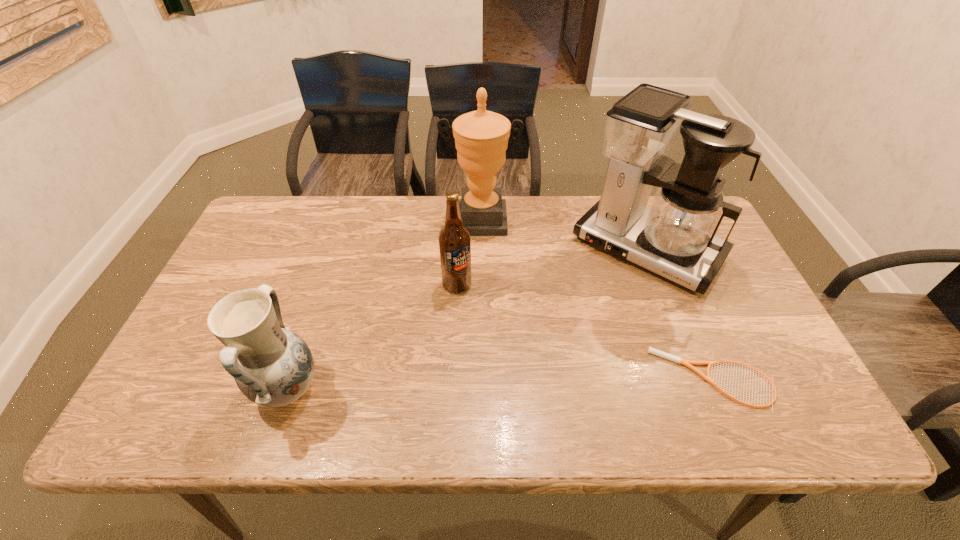
Point out which object is positioned as the third nearest to the beer bottle. Please provide its 2D coordinates. Your answer should be formatted as a tuple, i.e. [(x, y)], where the tuple contains the x and y coordinates of a point satisfying the conditions above.

[(272, 366)]

This screenshot has height=540, width=960. In order to click on object that is the second closest to the coffee maker in this screenshot , I will do `click(481, 137)`.

Image resolution: width=960 pixels, height=540 pixels. Find the location of `free space in the image that satisfies the following two spatial constraints: 1. on the front side of the tennis racket; 2. on the right side of the award`. free space in the image that satisfies the following two spatial constraints: 1. on the front side of the tennis racket; 2. on the right side of the award is located at coordinates (480, 380).

Find the location of a particular element. This screenshot has width=960, height=540. free space that satisfies the following two spatial constraints: 1. on the back side of the coffee maker; 2. on the right side of the beer bottle is located at coordinates (459, 249).

Locate an element on the screen. vacant area that satisfies the following two spatial constraints: 1. on the front side of the coffee maker; 2. on the left side of the award is located at coordinates (480, 249).

Locate an element on the screen. The height and width of the screenshot is (540, 960). blank area in the image that satisfies the following two spatial constraints: 1. on the back side of the beer bottle; 2. on the left side of the coffee maker is located at coordinates (459, 249).